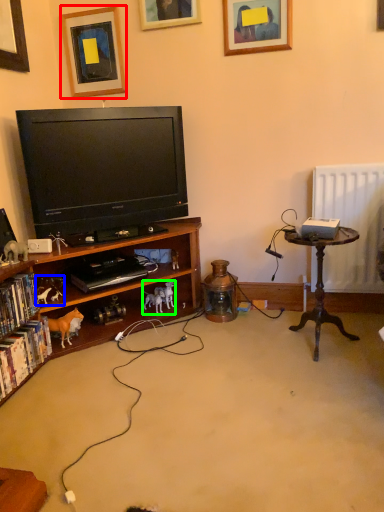
Question: Estimate the real-world distances between objects in this image. Which object is farther from picture frame (highlighted by a red box), toy (highlighted by a blue box) or toy (highlighted by a green box)?

Choices:
 (A) toy
 (B) toy

Answer: (B)